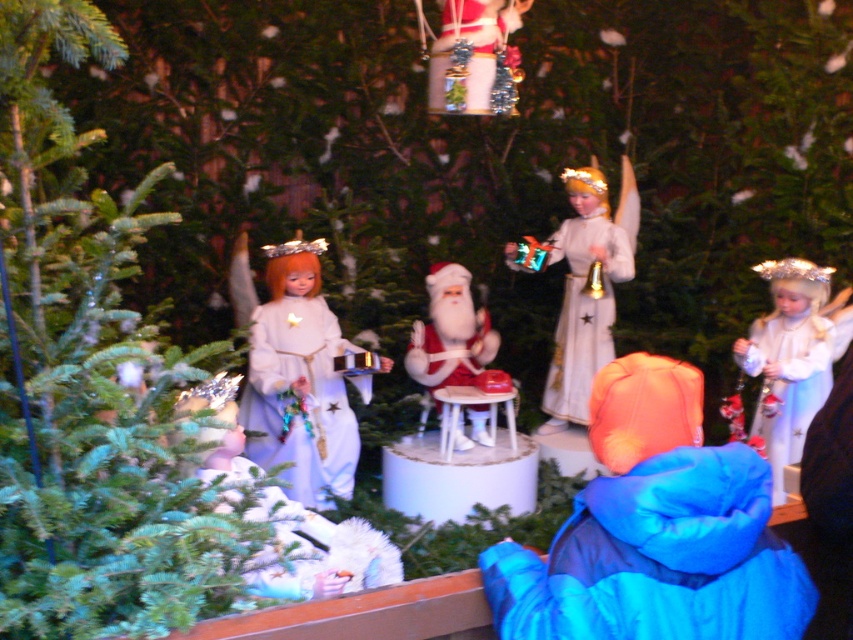
Question: Which object is positioned closest to the white glossy angel at center?

Choices:
 (A) blue puffy jacket at center
 (B) matte red santa at center

Answer: (B)

Question: Is blue puffy jacket at center positioned at the back of shiny silver ornament at upper center?

Choices:
 (A) yes
 (B) no

Answer: (B)

Question: Is white glossy doll at upper right smaller than shiny silver ornament at upper center?

Choices:
 (A) no
 (B) yes

Answer: (A)

Question: Estimate the real-world distances between objects in this image. Which object is farther from the white plastic stool at center?

Choices:
 (A) white glossy angel at center
 (B) white glossy doll at upper right
 (C) matte red santa at center

Answer: (B)

Question: Which object is the farthest from the matte red santa at center?

Choices:
 (A) blue puffy jacket at center
 (B) white plastic stool at center
 (C) white glossy doll at center

Answer: (A)

Question: Is white glossy angel at center above white plastic stool at center?

Choices:
 (A) no
 (B) yes

Answer: (B)